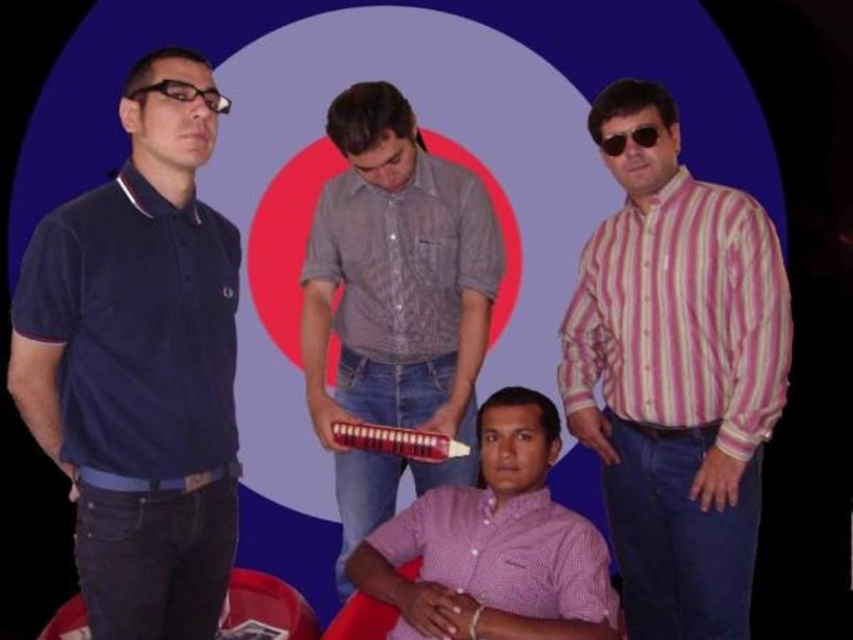
Can you confirm if navy blue polo shirt at left is thinner than pink checkered shirt at center?

Yes.

Between point (132, 70) and point (596, 557), which one is positioned in front?

Point (132, 70) is more forward.

What are the coordinates of `navy blue polo shirt at left` in the screenshot? It's located at (138, 378).

Is navy blue polo shirt at left in front of black plastic glasses at left?

That is True.

Consider the image. Can you confirm if navy blue polo shirt at left is wider than black plastic glasses at left?

Correct, the width of navy blue polo shirt at left exceeds that of black plastic glasses at left.

What do you see at coordinates (138, 378) in the screenshot? The width and height of the screenshot is (853, 640). I see `navy blue polo shirt at left` at bounding box center [138, 378].

Locate an element on the screen. The height and width of the screenshot is (640, 853). navy blue polo shirt at left is located at coordinates (138, 378).

Locate an element on the screen. This screenshot has width=853, height=640. navy blue polo shirt at left is located at coordinates (138, 378).